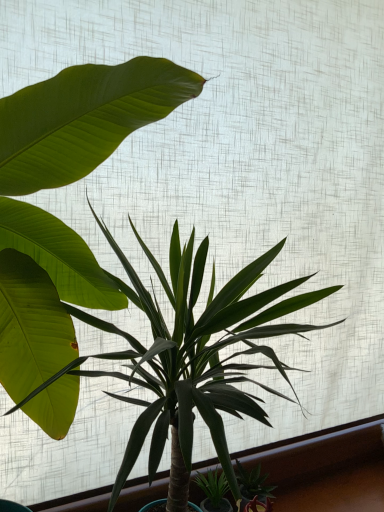
Question: From a real-world perspective, is green glossy succulent at lower right, arranged as the second houseplant when viewed from the left, on green glossy plant at center, which ranks as the second houseplant in bottom-to-top order?

Choices:
 (A) yes
 (B) no

Answer: (B)

Question: Is green glossy plant at center, which is the 2th houseplant in right-to-left order, inside green glossy succulent at lower right, arranged as the first houseplant when ordered from the bottom?

Choices:
 (A) no
 (B) yes

Answer: (A)

Question: Is green glossy succulent at lower right, arranged as the second houseplant when viewed from the left, wider than green glossy plant at center, which ranks as the second houseplant in bottom-to-top order?

Choices:
 (A) no
 (B) yes

Answer: (A)

Question: Is green glossy succulent at lower right, positioned as the second houseplant in top-to-bottom order, placed right next to green glossy plant at center, the 1th houseplant in the top-to-bottom sequence?

Choices:
 (A) no
 (B) yes

Answer: (A)

Question: From the image's perspective, is green glossy succulent at lower right, which ranks as the 1th houseplant in right-to-left order, below green glossy plant at center, which is the 2th houseplant in right-to-left order?

Choices:
 (A) yes
 (B) no

Answer: (A)

Question: From a real-world perspective, is green glossy succulent at lower right, positioned as the second houseplant in top-to-bottom order, located beneath green glossy plant at center, the 1th houseplant in the top-to-bottom sequence?

Choices:
 (A) yes
 (B) no

Answer: (A)

Question: Would you say green glossy plant at center, arranged as the first houseplant when viewed from the left, contains green glossy succulent at lower right, arranged as the second houseplant when viewed from the left?

Choices:
 (A) yes
 (B) no

Answer: (A)

Question: Are green glossy plant at center, the 1th houseplant in the top-to-bottom sequence, and green glossy succulent at lower right, positioned as the second houseplant in top-to-bottom order, located far from each other?

Choices:
 (A) no
 (B) yes

Answer: (A)

Question: Does green glossy plant at center, which ranks as the second houseplant in bottom-to-top order, have a greater width compared to green glossy succulent at lower right, which ranks as the 1th houseplant in right-to-left order?

Choices:
 (A) no
 (B) yes

Answer: (B)

Question: Is green glossy plant at center, the 1th houseplant in the top-to-bottom sequence, oriented towards green glossy succulent at lower right, positioned as the second houseplant in top-to-bottom order?

Choices:
 (A) no
 (B) yes

Answer: (A)

Question: Is green glossy plant at center, which is the 2th houseplant in right-to-left order, to the left of green glossy succulent at lower right, arranged as the first houseplant when ordered from the bottom, from the viewer's perspective?

Choices:
 (A) no
 (B) yes

Answer: (B)

Question: Would you say green glossy plant at center, arranged as the first houseplant when viewed from the left, is outside green glossy succulent at lower right, arranged as the first houseplant when ordered from the bottom?

Choices:
 (A) no
 (B) yes

Answer: (B)

Question: From their relative heights in the image, would you say green glossy succulent at lower right, positioned as the second houseplant in top-to-bottom order, is taller or shorter than green glossy plant at center, which ranks as the second houseplant in bottom-to-top order?

Choices:
 (A) short
 (B) tall

Answer: (A)